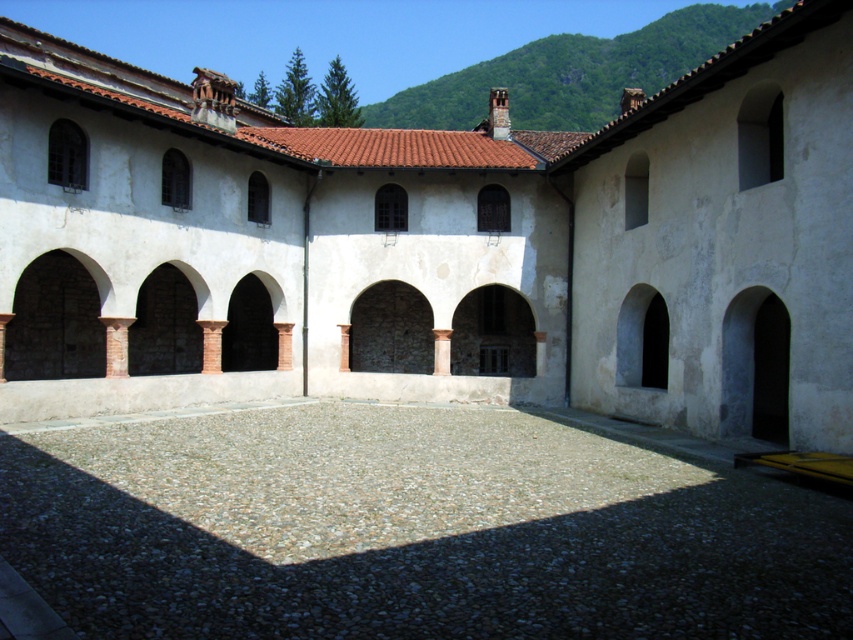
You are standing in the courtyard and want to exit through the archway. Which direction should you walk to move from the white stone courtyard at center to the dark gray stone archway at lower right?

You should walk towards the lower right direction to move from the white stone courtyard at center to the dark gray stone archway at lower right since the courtyard is in front of the archway.

You are standing in the courtyard and want to walk towards the building. Which point, point (573, 310) or point (409, 369), is closer to you?

Point (573, 310) is closer to the camera than point (409, 369), so it is closer to you.